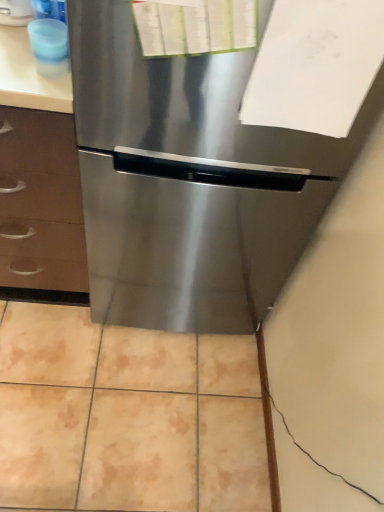
Question: From a real-world perspective, is white matte paper at upper right positioned above or below stainless steel refrigerator at center?

Choices:
 (A) above
 (B) below

Answer: (A)

Question: Considering the positions of white matte paper at upper right and stainless steel refrigerator at center in the image, is white matte paper at upper right wider or thinner than stainless steel refrigerator at center?

Choices:
 (A) thin
 (B) wide

Answer: (A)

Question: Which object is the farthest from the white matte paper at upper right?

Choices:
 (A) stainless steel refrigerator at center
 (B) beige ceramic tile at center
 (C) translucent blue cup at upper left

Answer: (B)

Question: Considering the real-world distances, which object is closest to the stainless steel refrigerator at center?

Choices:
 (A) beige ceramic tile at center
 (B) white matte paper at upper right
 (C) translucent blue cup at upper left

Answer: (B)